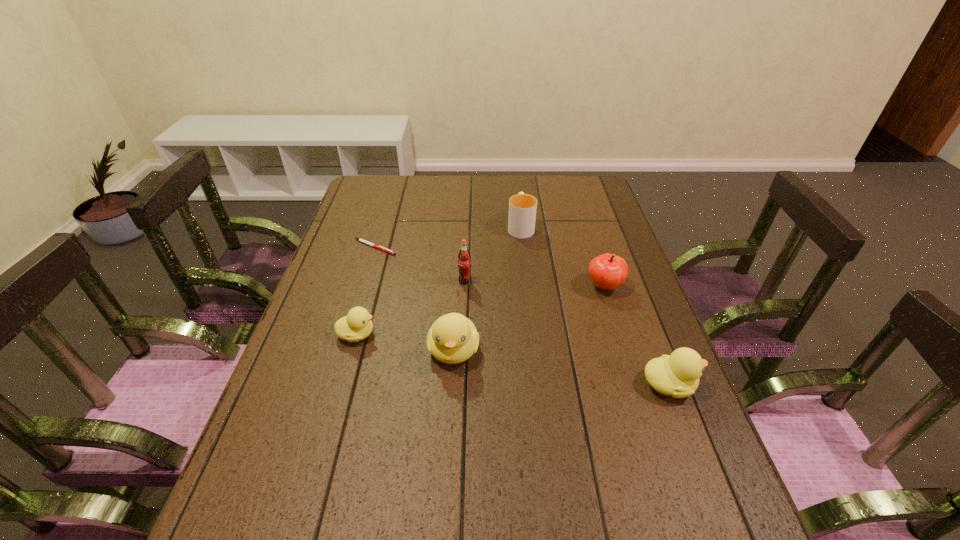
Find the location of a particular element. vacant region that satisfies the following two spatial constraints: 1. on the clicker of the pen; 2. on the left side of the apple is located at coordinates (363, 286).

At what (x,y) coordinates should I click in order to perform the action: click on vacant space that satisfies the following two spatial constraints: 1. on the clicker of the apple; 2. on the right side of the shortest object. Please return your answer as a coordinate pair (x, y). The height and width of the screenshot is (540, 960). Looking at the image, I should click on (363, 286).